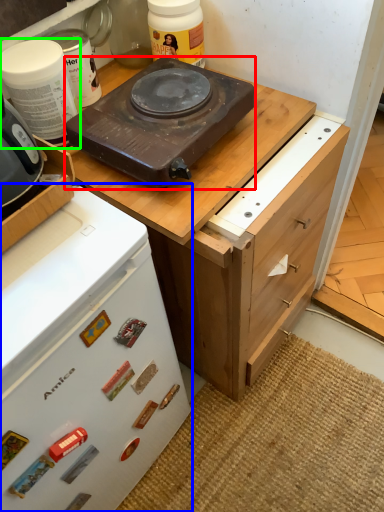
Question: Based on their relative distances, which object is farther from kitchen appliance (highlighted by a red box)? Choose from home appliance (highlighted by a blue box) and kitchen appliance (highlighted by a green box).

Choices:
 (A) home appliance
 (B) kitchen appliance

Answer: (A)